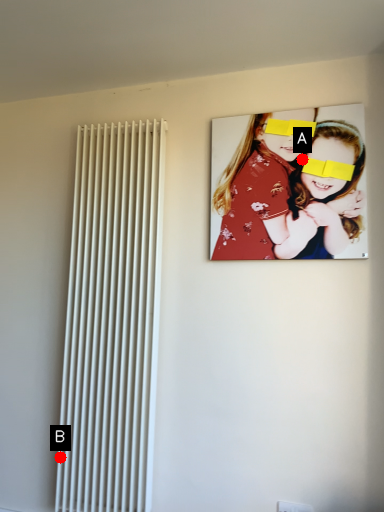
Question: Two points are circled on the image, labeled by A and B beside each circle. Which point is further to the camera?

Choices:
 (A) A is further
 (B) B is further

Answer: (B)